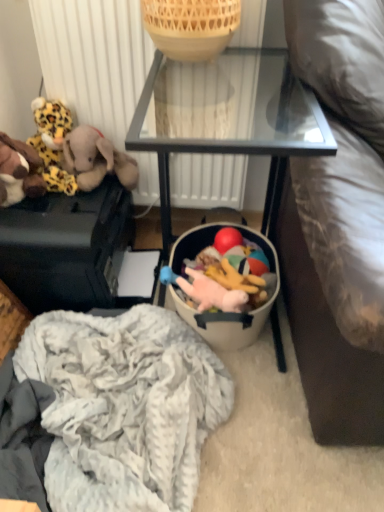
Locate an element on the screen. free spot below bamboo basket at upper center (from a real-world perspective) is located at coordinates (184, 62).